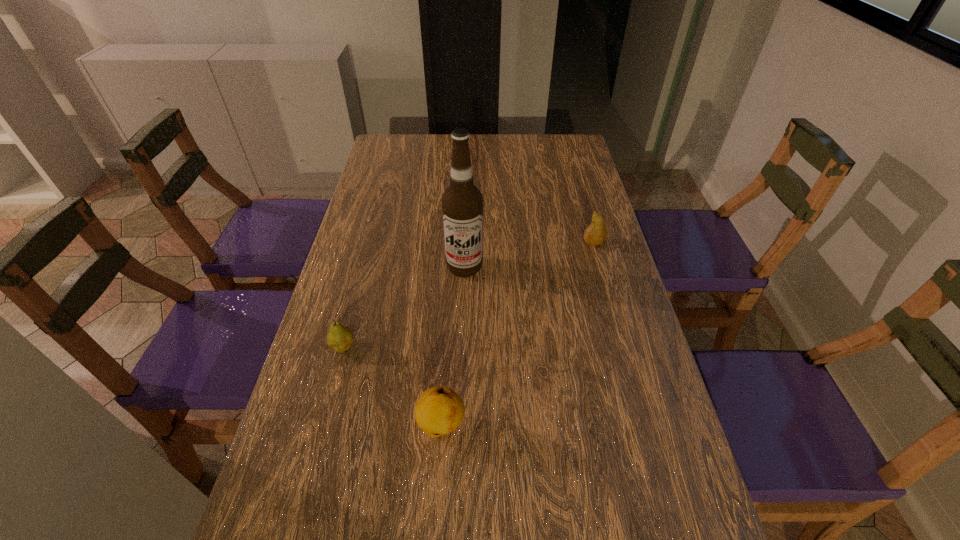
Where is `the tallest object`? the tallest object is located at coordinates (462, 203).

Where is `alcohol`? The image size is (960, 540). alcohol is located at coordinates (462, 203).

At what (x,y) coordinates should I click in order to perform the action: click on the second pear from right to left. Please return your answer as a coordinate pair (x, y). The image size is (960, 540). Looking at the image, I should click on (439, 410).

Find the location of a particular element. Image resolution: width=960 pixels, height=540 pixels. the nearest object is located at coordinates (439, 410).

Where is `the rightmost object`? This screenshot has width=960, height=540. the rightmost object is located at coordinates (596, 233).

Where is `the farthest object`? The image size is (960, 540). the farthest object is located at coordinates (596, 233).

I want to click on the shortest object, so pos(340,338).

Locate an element on the screen. the third farthest object is located at coordinates (340, 338).

Find the location of a particular element. The image size is (960, 540). free space located 0.380m on the label of the alcohol is located at coordinates (460, 405).

Locate an element on the screen. vacant area located 0.260m on the right of the nearest object is located at coordinates (590, 426).